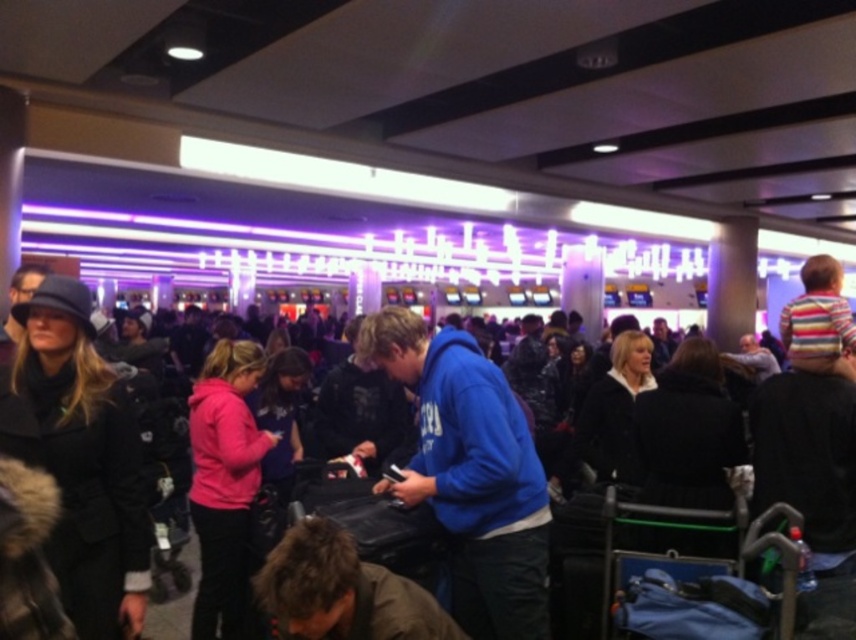
You are a traveler trying to navigate through the crowd in the airport checkin area. You see a black wool coat at left and a pink fleece jacket at center. Which path would require less space to pass between them?

The path between the black wool coat at left and the pink fleece jacket at center requires less space because the black wool coat at left occupies less space than the pink fleece jacket at center.

You are a traveler who needs to locate your luggage. You see a black wool coat at left and a pink fleece jacket at center. Which clothing item is closer to you?

The black wool coat at left is closer to you because it is in front of the pink fleece jacket at center.